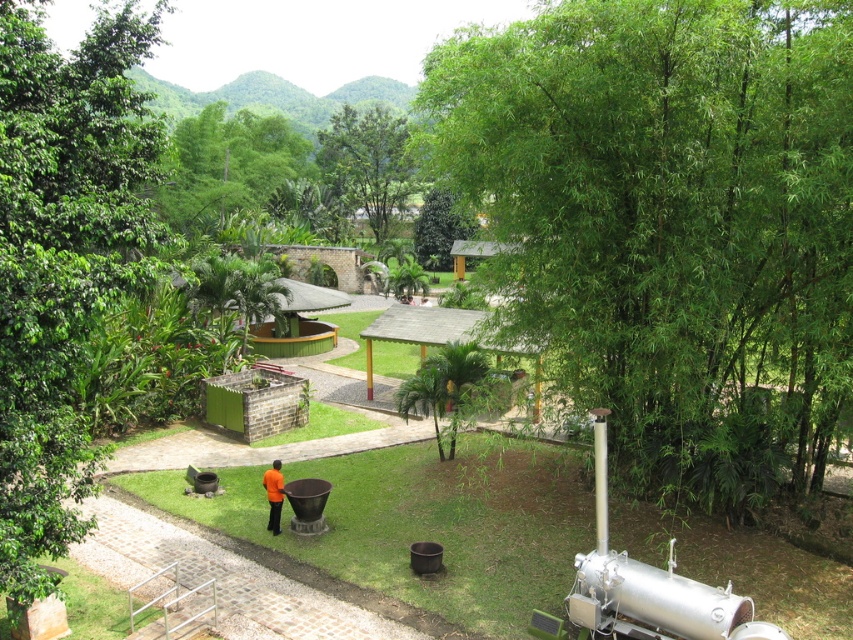
You are standing at the center of the paved pathway in the foreground of the image. You see a large industrial structure with a metallic tank and a tall cylindrical pipe on the right side. There is also a green leafy bamboo marked by the point at coordinates (x=671, y=224). Which object is closer to you, the industrial structure or the green leafy bamboo?

The green leafy bamboo at point (x=671, y=224) is closer to you than the industrial structure on the right side because the point is located in the foreground.

You are a photographer standing on the paved pathway in the foreground of the scene. You want to capture a photo that includes both the green leafy bamboo at right and the orange fabric shirt at center. Which object should you focus on first if you want to ensure both are in the frame without moving your camera position?

Since the green leafy bamboo at right is larger in size than the orange fabric shirt at center, you should focus on the green leafy bamboo at right first to ensure it fits within the frame, then adjust to include the smaller orange fabric shirt at center.

You are standing on the paved pathway in the park and see both the green leafy tree at left and the green leafy tree at upper left. Which tree is positioned more to the right from your perspective?

The green leafy tree at left is positioned more to the right compared to the green leafy tree at upper left.